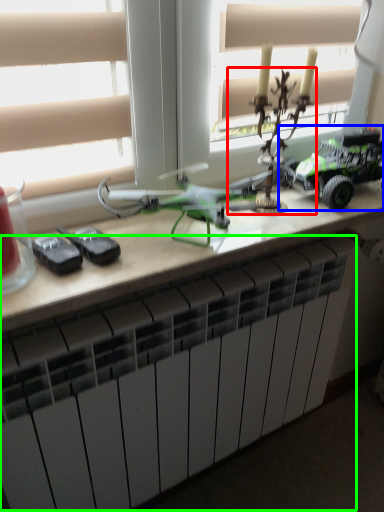
Question: Which object is positioned closest to toy (highlighted by a red box)? Select from toy (highlighted by a blue box) and radiator (highlighted by a green box).

Choices:
 (A) toy
 (B) radiator

Answer: (A)